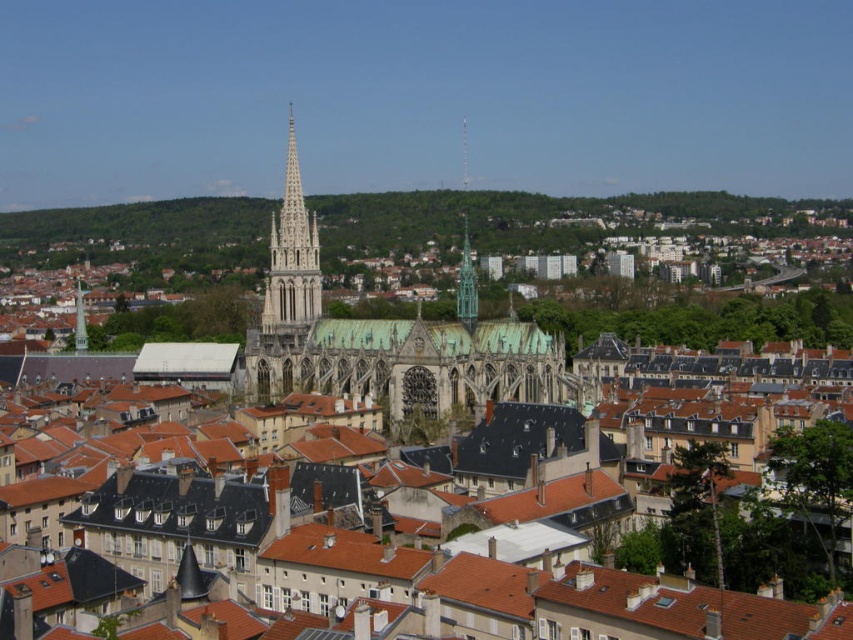
You are an architect analyzing the cathedral in the cityscape. You notice the green copper roof at center and the green glass spire at center. Which of these two elements is closer to the front of the cathedral structure?

The green copper roof at center is in front of the green glass spire at center, so it is closer to the front of the cathedral structure.

You are an architect analyzing the cathedral design. You observe the white stone spire at center and the green glass spire at center. Which spire has a greater width?

The white stone spire at center has a greater width than the green glass spire at center.

Consider the image. You are a drone operator tasked with flying a drone between the white stone spire at center and the green glass spire at center. The drone has a maximum flight distance of 40 meters. Can the drone safely fly between these two spires without exceeding its maximum flight distance?

The distance between the white stone spire at center and the green glass spire at center is 39.48 meters, which is within the drone operator maximum flight distance of 40 meters. The drone can safely fly between them.